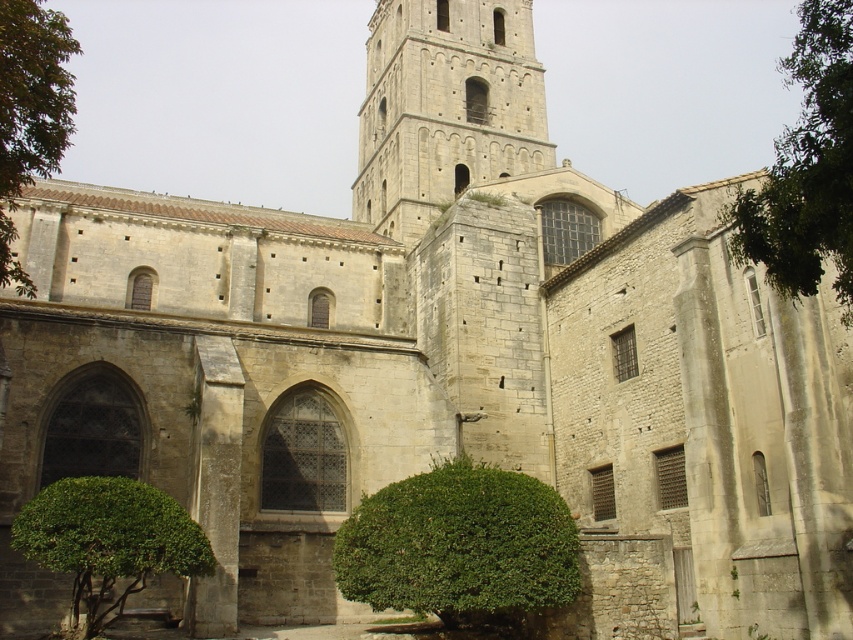
Question: Which object is positioned closest to the green leafy bush at center?

Choices:
 (A) green leafy bush at lower left
 (B) gray stone tower at center
 (C) green leafy tree at upper right
 (D) green leafy bush at left

Answer: (A)

Question: Is green leafy bush at center to the right of green leafy bush at lower left from the viewer's perspective?

Choices:
 (A) yes
 (B) no

Answer: (A)

Question: Among these points, which one is nearest to the camera?

Choices:
 (A) (178, 561)
 (B) (846, 12)
 (C) (370, 93)

Answer: (B)

Question: Where is green leafy bush at lower left located in relation to green leafy bush at left in the image?

Choices:
 (A) right
 (B) left

Answer: (A)

Question: Can you confirm if green leafy bush at center is positioned to the right of green leafy bush at left?

Choices:
 (A) yes
 (B) no

Answer: (A)

Question: Which of the following is the farthest from the observer?

Choices:
 (A) green leafy tree at upper right
 (B) gray stone tower at center
 (C) green leafy bush at left

Answer: (B)